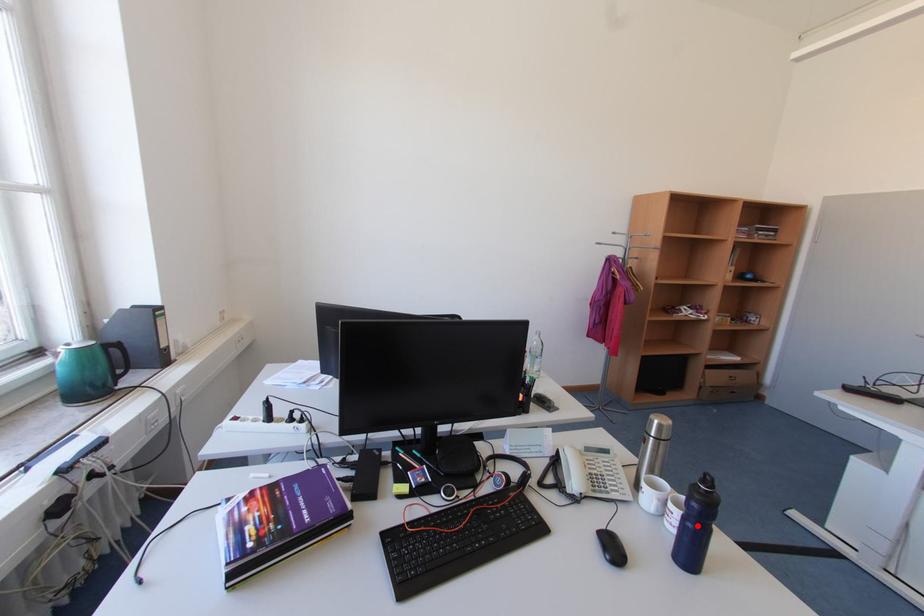
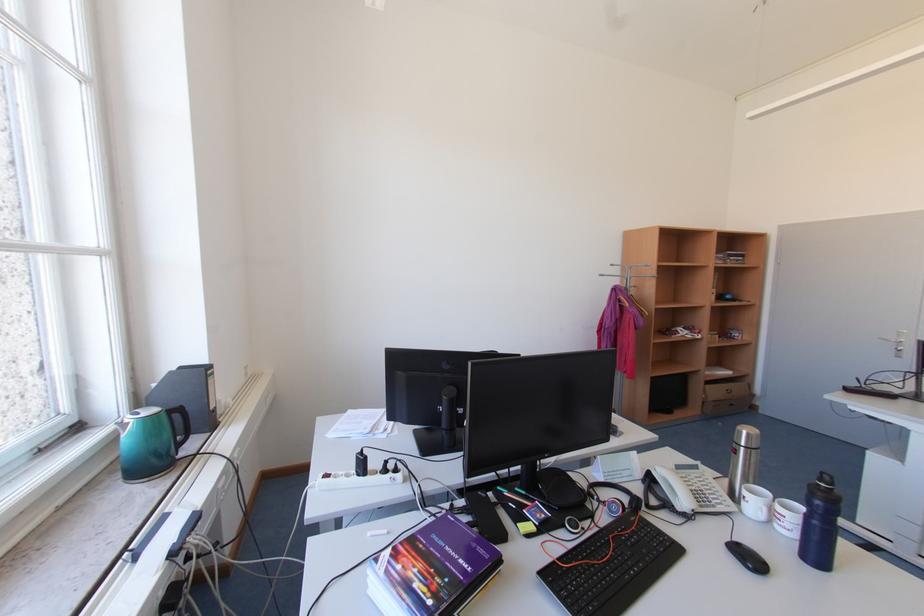
Question: I am providing you with two images of the same scene from different viewpoints. A red point is marked on the first image. Can you still see the location of the red point in image 2?

Choices:
 (A) Yes
 (B) No

Answer: (A)